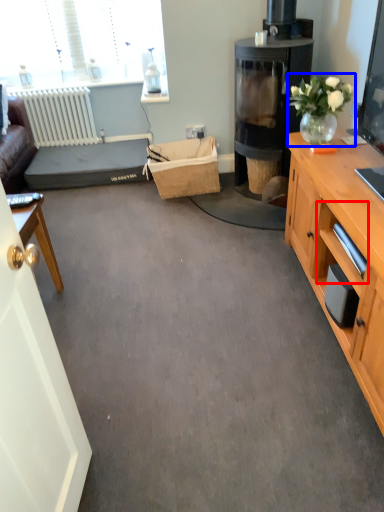
Question: Which of the following is the closest to the observer, drawer (highlighted by a red box) or houseplant (highlighted by a blue box)?

Choices:
 (A) drawer
 (B) houseplant

Answer: (A)